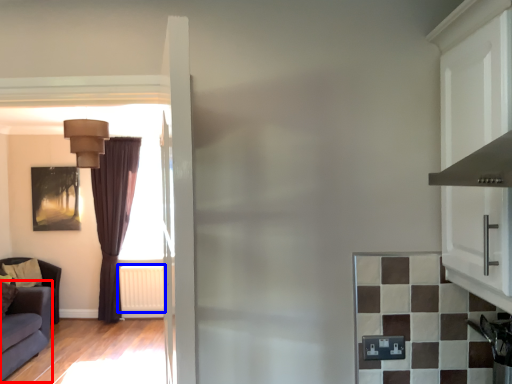
Question: Among these objects, which one is farthest to the camera, studio couch (highlighted by a red box) or radiator (highlighted by a blue box)?

Choices:
 (A) studio couch
 (B) radiator

Answer: (B)